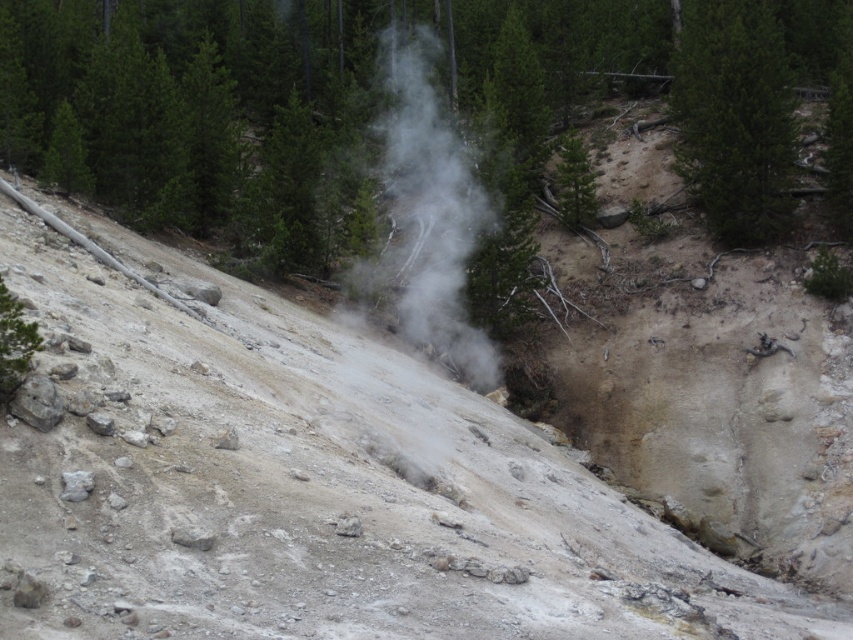
You are a geologist examining the geothermal area. You notice the dull gray rock at center and the green matte tree at upper right. Which object has a greater width?

The dull gray rock at center has a greater width than the green matte tree at upper right.

You are a geologist standing at the edge of a geothermal area. You notice a dull gray rock at center and a steam vent. How far apart are these two features in meters?

The dull gray rock at center and the steam vent are 27.62 feet apart, which converts to approximately 8.42 meters. Therefore, the distance between them is about 8.42 meters.

You are a geologist examining the image of the geothermal area. You notice the white vapor at center. Can you determine the location of the white vapor at center relative to the point marked at coordinates (427, 221)?

The white vapor at center is located exactly at the point marked at coordinates (427, 221).